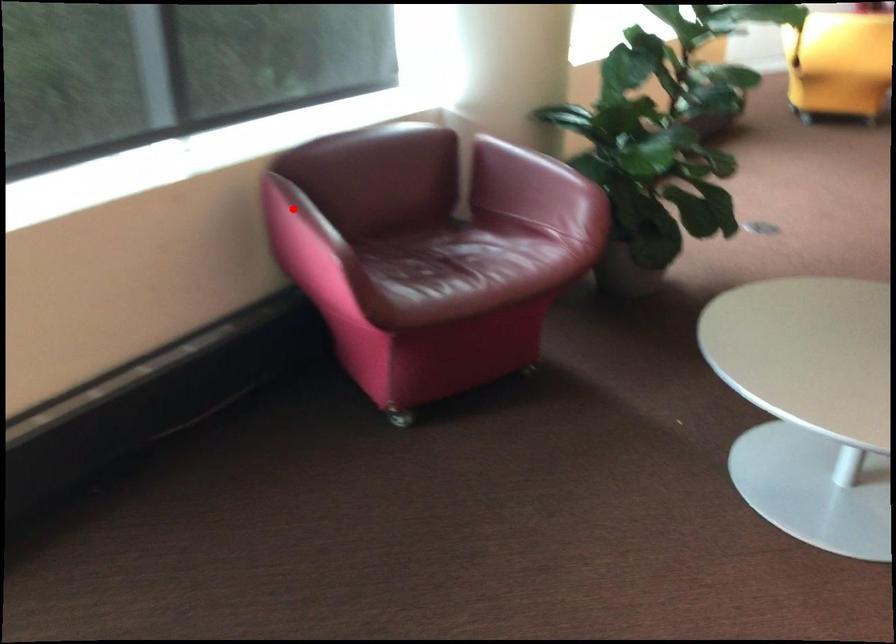
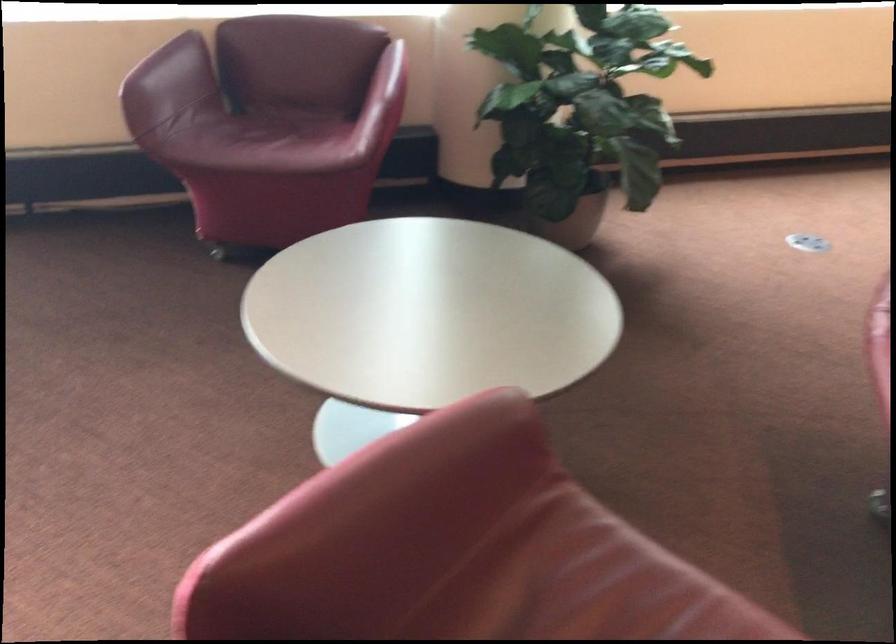
Question: A red point is marked in image1. In image2, is the corresponding 3D point closer to the camera or farther? Reply with the corresponding letter.

Choices:
 (A) The corresponding 3D point is closer.
 (B) The corresponding 3D point is farther.

Answer: (B)